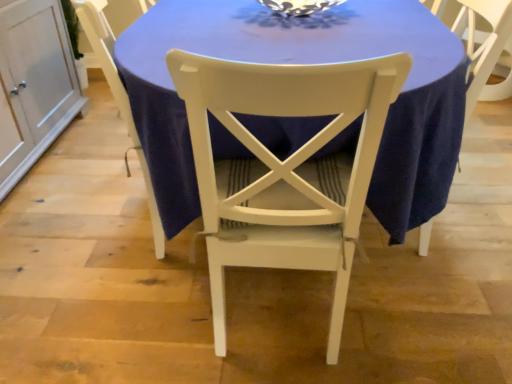
Question: Which direction should I rotate to look at white painted wood chair at center, acting as the 2th chair starting from the right?

Choices:
 (A) right
 (B) left

Answer: (B)

Question: Does white painted wood chair at center, positioned as the 1th chair in right-to-left order, appear on the right side of blue fabric table at center?

Choices:
 (A) yes
 (B) no

Answer: (B)

Question: From a real-world perspective, is white painted wood chair at center, positioned as the 1th chair in right-to-left order, under blue fabric table at center?

Choices:
 (A) no
 (B) yes

Answer: (A)

Question: Considering the relative sizes of white painted wood chair at center, arranged as the second chair when viewed from the left, and blue fabric table at center in the image provided, is white painted wood chair at center, arranged as the second chair when viewed from the left, bigger than blue fabric table at center?

Choices:
 (A) no
 (B) yes

Answer: (A)

Question: Is white painted wood chair at center, arranged as the second chair when viewed from the left, positioned in front of blue fabric table at center?

Choices:
 (A) no
 (B) yes

Answer: (B)

Question: Is white painted wood chair at center, arranged as the second chair when viewed from the left, directly adjacent to blue fabric table at center?

Choices:
 (A) no
 (B) yes

Answer: (A)

Question: From a real-world perspective, is white painted wood chair at center, arranged as the second chair when viewed from the left, physically above blue fabric table at center?

Choices:
 (A) yes
 (B) no

Answer: (A)

Question: Is white painted wood chair at center, acting as the 2th chair starting from the right, taller than white painted wood chair at center, arranged as the second chair when viewed from the left?

Choices:
 (A) no
 (B) yes

Answer: (B)

Question: Can we say white painted wood chair at center, acting as the 2th chair starting from the right, lies outside white painted wood chair at center, positioned as the 1th chair in right-to-left order?

Choices:
 (A) no
 (B) yes

Answer: (B)

Question: Is white painted wood chair at center, acting as the 2th chair starting from the right, positioned far away from white painted wood chair at center, positioned as the 1th chair in right-to-left order?

Choices:
 (A) no
 (B) yes

Answer: (A)

Question: Does white painted wood chair at center, which is the first chair in left-to-right order, have a lesser width compared to white painted wood chair at center, positioned as the 1th chair in right-to-left order?

Choices:
 (A) no
 (B) yes

Answer: (B)

Question: From a real-world perspective, is white painted wood chair at center, which is the first chair in left-to-right order, positioned under white painted wood chair at center, positioned as the 1th chair in right-to-left order, based on gravity?

Choices:
 (A) yes
 (B) no

Answer: (A)

Question: Is white painted wood chair at center, positioned as the 1th chair in right-to-left order, a part of white painted wood chair at center, which is the first chair in left-to-right order?

Choices:
 (A) yes
 (B) no

Answer: (B)

Question: Can white painted wood chair at center, which is the first chair in left-to-right order, be found inside blue fabric table at center?

Choices:
 (A) no
 (B) yes

Answer: (B)